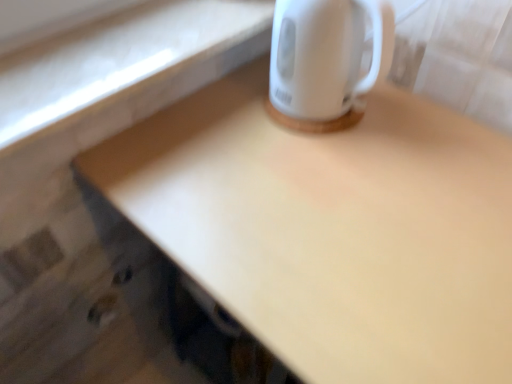
Locate an element on the screen. The width and height of the screenshot is (512, 384). vacant area that is situated to the right of white glossy electric kettle at upper right is located at coordinates (420, 113).